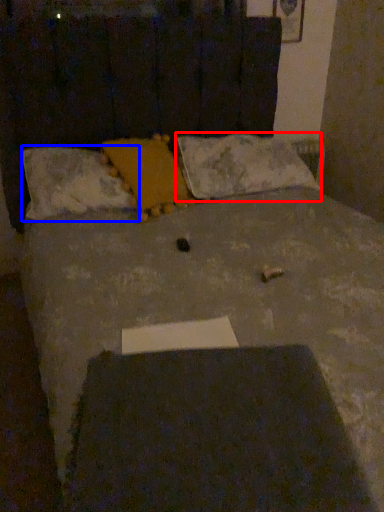
Question: Among these objects, which one is farthest to the camera, pillow (highlighted by a red box) or pillow (highlighted by a blue box)?

Choices:
 (A) pillow
 (B) pillow

Answer: (A)